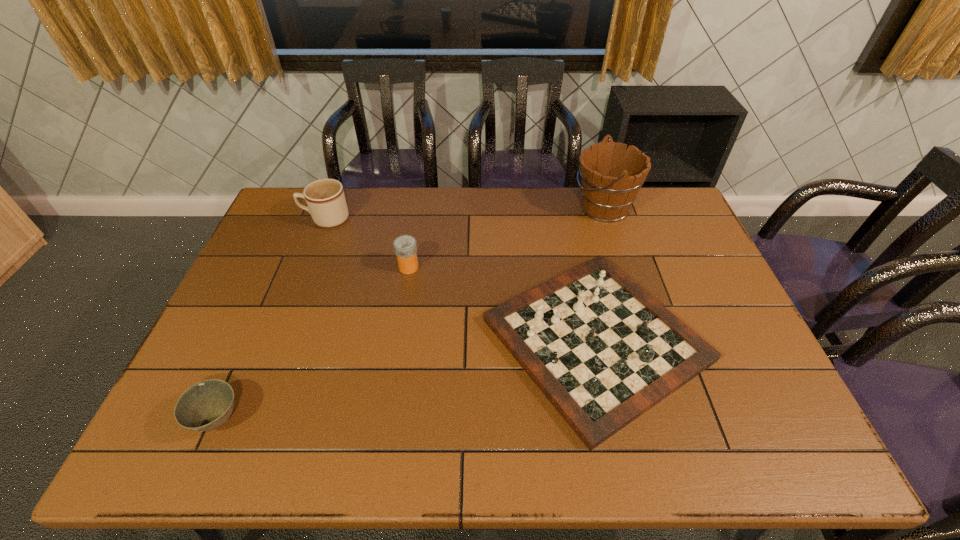
This screenshot has height=540, width=960. What are the coordinates of `wine bucket` in the screenshot? It's located at (611, 178).

Locate an element on the screen. The height and width of the screenshot is (540, 960). mug is located at coordinates (325, 198).

Where is `medicine`? This screenshot has height=540, width=960. medicine is located at coordinates (405, 246).

The height and width of the screenshot is (540, 960). What are the coordinates of `chessboard` in the screenshot? It's located at (603, 351).

Locate an element on the screen. the shortest object is located at coordinates (206, 405).

Locate an element on the screen. vacant space located 0.100m with the handle on the wine bucket is located at coordinates (544, 207).

What are the coordinates of `vacant space located with the handle on the wine bucket` in the screenshot? It's located at (547, 207).

This screenshot has width=960, height=540. In order to click on free space located with the handle on the wine bucket in this screenshot , I will do `click(497, 207)`.

Locate an element on the screen. This screenshot has height=540, width=960. free point located on the side of the mug with the handle is located at coordinates (274, 219).

Locate an element on the screen. vacant space situated on the label side of the medicine is located at coordinates (509, 267).